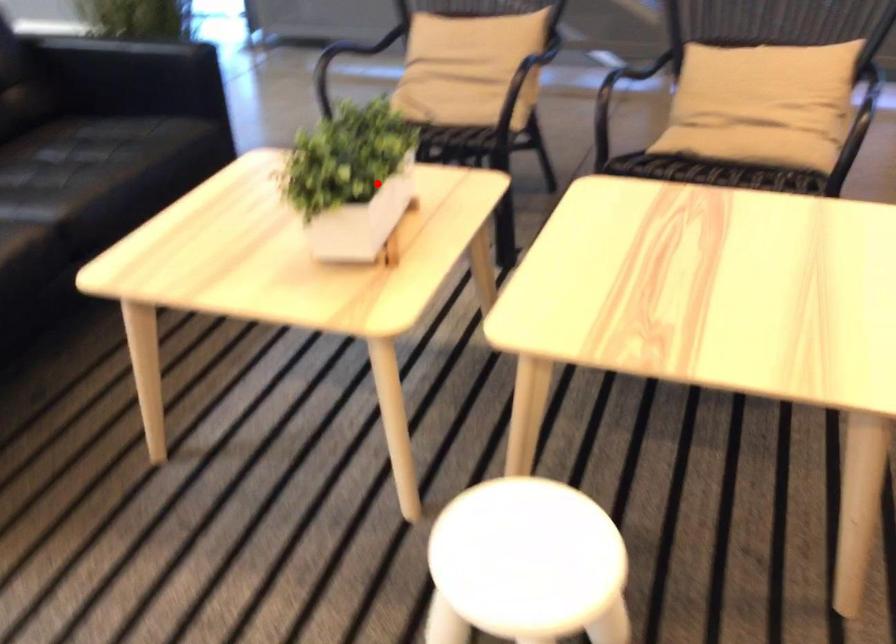
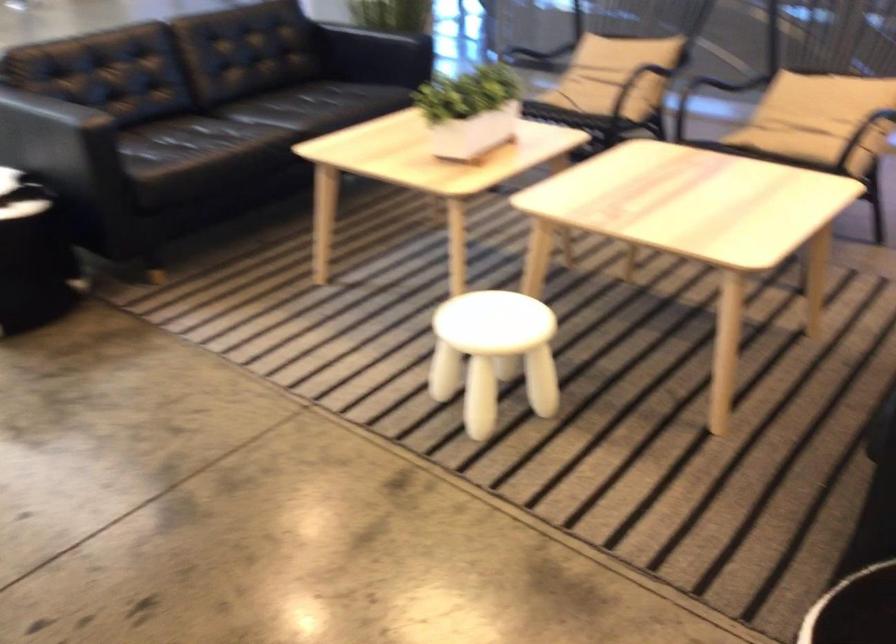
Question: I am providing you with two images of the same scene from different viewpoints. In image1, a red point is highlighted. Considering the same 3D point in image2, which of the following is correct?

Choices:
 (A) It is closer
 (B) It is farther

Answer: (B)